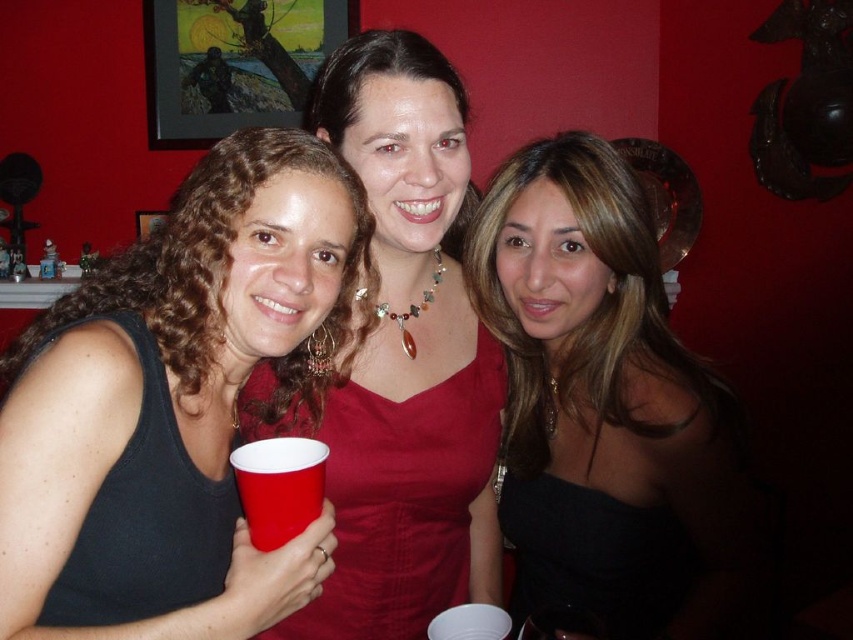
You are at a party and want to take a photo of the matte black tank top at left and the matte red dress at center. Since you can only focus on one person at a time, which one should you focus on to ensure the other is still in the background?

You should focus on the matte black tank top at left because it is in front of the matte red dress at center, so focusing on it will keep the background dress in view.

You are organizing a charity clothing drive and need to decide which items to donate. The donation guidelines state that only clothing items with a size of medium or smaller are acceptable. You have two items to evaluate from the image described above. The first is the matte black tank top at left, and the second is the matte red dress at center. Based on the size information provided, which of these items would qualify for donation?

The matte red dress at center qualifies for donation because it has a smaller size compared to the matte black tank top at left, which may exceed the medium size limit.